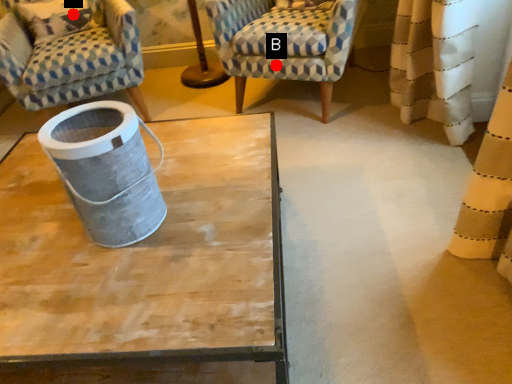
Question: Two points are circled on the image, labeled by A and B beside each circle. Which point is further to the camera?

Choices:
 (A) A is further
 (B) B is further

Answer: (A)